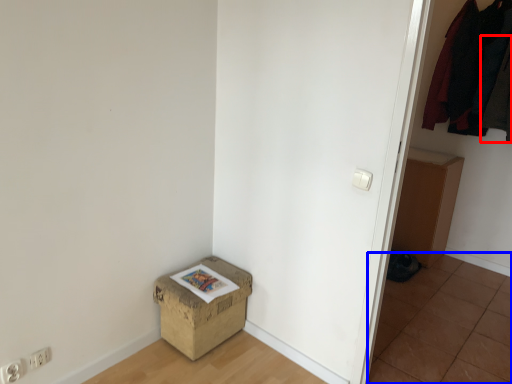
Question: Among these objects, which one is farthest to the camera, clothing (highlighted by a red box) or tile (highlighted by a blue box)?

Choices:
 (A) clothing
 (B) tile

Answer: (A)